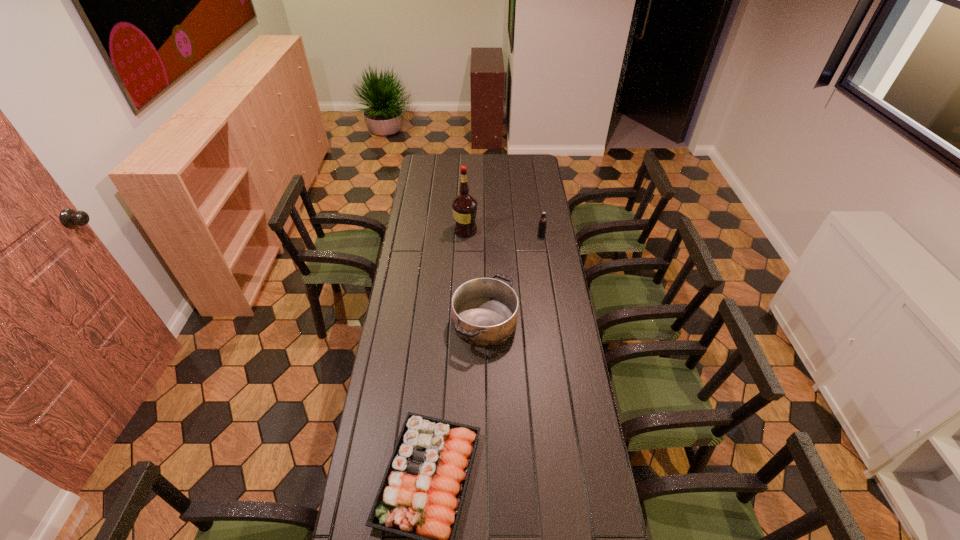
You are a GUI agent. You are given a task and a screenshot of the screen. Output one action in this format:
    pyautogui.click(x=<x>, y=<y>)
    Task: Click on the alcohol
    This screenshot has width=960, height=540.
    Given the screenshot: What is the action you would take?
    pyautogui.click(x=464, y=206)

The image size is (960, 540). I want to click on pop, so (x=542, y=224).

Identify the location of the third farthest object. Image resolution: width=960 pixels, height=540 pixels. (484, 310).

Locate an element on the screen. The width and height of the screenshot is (960, 540). free space located 0.380m on the label of the tallest object is located at coordinates (552, 231).

The image size is (960, 540). What are the coordinates of `vacant region located on the front label of the rightmost object` in the screenshot? It's located at (549, 284).

Find the location of a particular element. This screenshot has height=540, width=960. vacant space located on the front of the third farthest object is located at coordinates (486, 382).

Image resolution: width=960 pixels, height=540 pixels. In order to click on object located in the right edge section of the desktop in this screenshot , I will do `click(542, 224)`.

Find the location of a particular element. vacant area at the far edge of the desktop is located at coordinates pyautogui.click(x=499, y=170).

The width and height of the screenshot is (960, 540). Find the location of `vacant region at the left edge of the desktop`. vacant region at the left edge of the desktop is located at coordinates (411, 230).

What are the coordinates of `free location at the right edge of the desktop` in the screenshot? It's located at (526, 185).